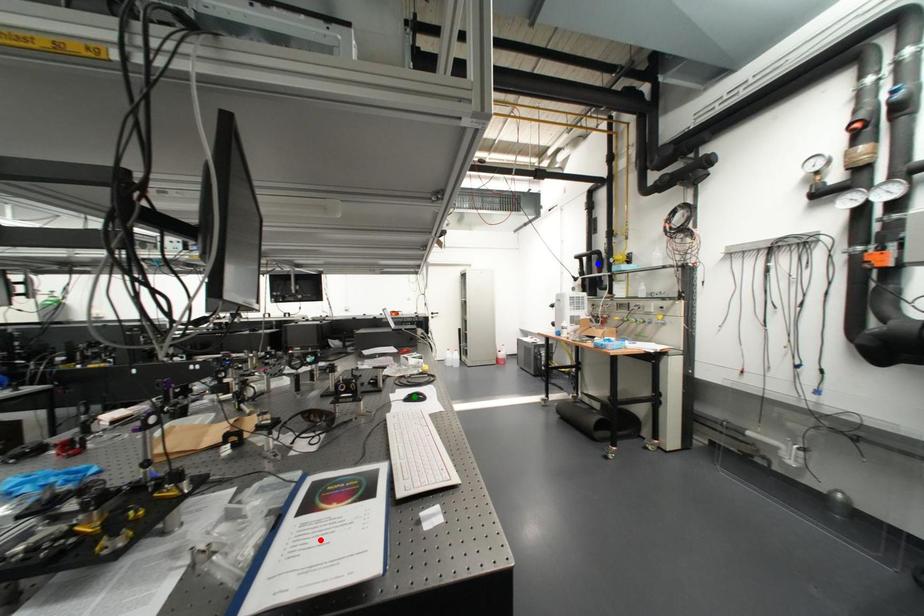
Order these from farthest to nearest:
A) green point
B) red point
C) blue point

blue point → green point → red point